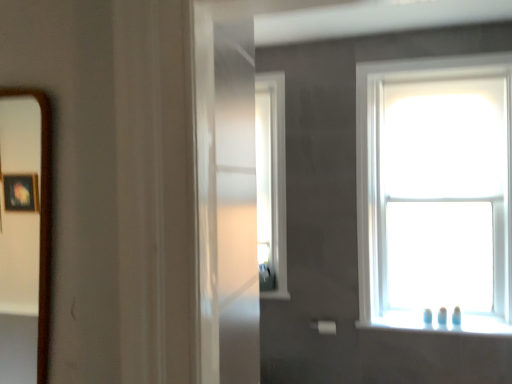
Question: Considering the positions of white matte towel bar at lower right and white glossy window sill at lower right in the image, is white matte towel bar at lower right taller or shorter than white glossy window sill at lower right?

Choices:
 (A) short
 (B) tall

Answer: (B)

Question: In the image, is white matte towel bar at lower right on the left side or the right side of white glossy window sill at lower right?

Choices:
 (A) right
 (B) left

Answer: (B)

Question: Which object is positioned farthest from the transparent glass window at upper right, positioned as the 1th window in right-to-left order?

Choices:
 (A) white matte towel bar at lower right
 (B) brown wooden mirror at left
 (C) white glossy window sill at lower right
 (D) clear glass window at center, which ranks as the first window in left-to-right order

Answer: (B)

Question: Which is farther from the white glossy window sill at lower right?

Choices:
 (A) brown wooden mirror at left
 (B) white matte towel bar at lower right
 (C) clear glass window at center, which ranks as the first window in left-to-right order
 (D) transparent glass window at upper right, the second window in the left-to-right sequence

Answer: (A)